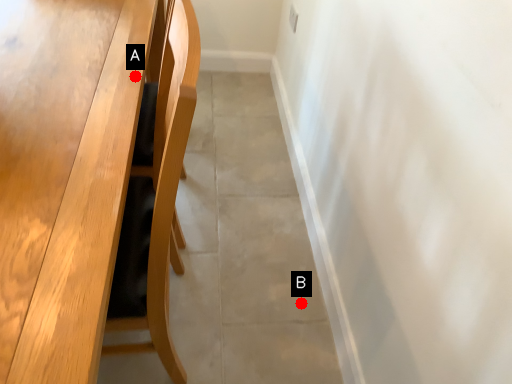
Question: Two points are circled on the image, labeled by A and B beside each circle. Which point appears closest to the camera in this image?

Choices:
 (A) A is closer
 (B) B is closer

Answer: (A)